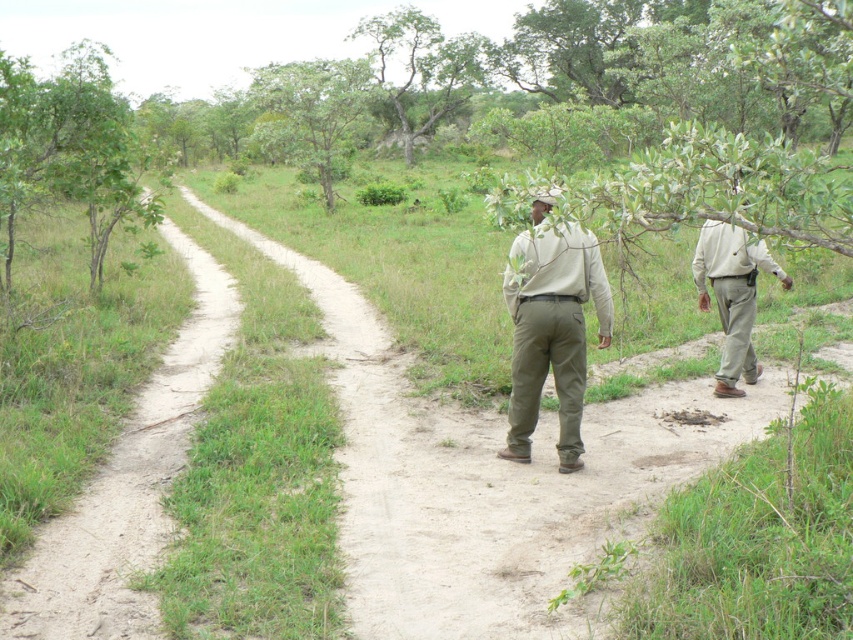
Is green leafy tree at upper center thinner than green leafy tree at center?

Yes, green leafy tree at upper center is thinner than green leafy tree at center.

Who is lower down, green leafy tree at upper center or green leafy tree at center?

green leafy tree at center

Is point (395, 96) in front of point (258, 134)?

No, it is not.

This screenshot has width=853, height=640. I want to click on green leafy tree at upper center, so click(x=421, y=68).

Is green leafy tree at center below khaki pants at right?

No, green leafy tree at center is not below khaki pants at right.

Between green leafy tree at center and khaki pants at right, which one appears on the right side from the viewer's perspective?

Positioned to the right is khaki pants at right.

Which is behind, point (341, 124) or point (740, 362)?

The point (341, 124) is more distant.

What are the coordinates of `green leafy tree at center` in the screenshot? It's located at (312, 112).

How much distance is there between green leafy tree at upper left and green leafy tree at center?

Answer: A distance of 33.78 feet exists between green leafy tree at upper left and green leafy tree at center.

Is point (119, 116) farther from viewer compared to point (289, 122)?

No, it is in front of (289, 122).

You are a GUI agent. You are given a task and a screenshot of the screen. Output one action in this format:
    pyautogui.click(x=<x>, y=<y>)
    Task: Click on the green leafy tree at upper left
    
    Given the screenshot: What is the action you would take?
    pyautogui.click(x=68, y=148)